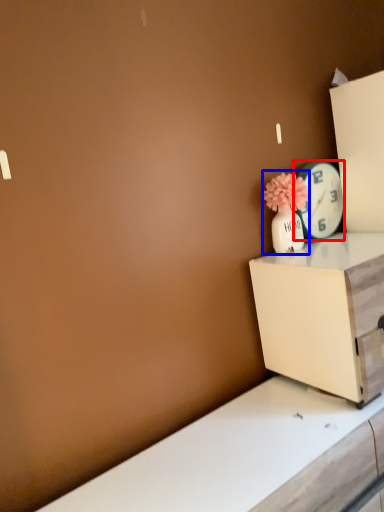
Question: Which object is further to the camera taking this photo, clock (highlighted by a red box) or floral arrangement (highlighted by a blue box)?

Choices:
 (A) clock
 (B) floral arrangement

Answer: (A)